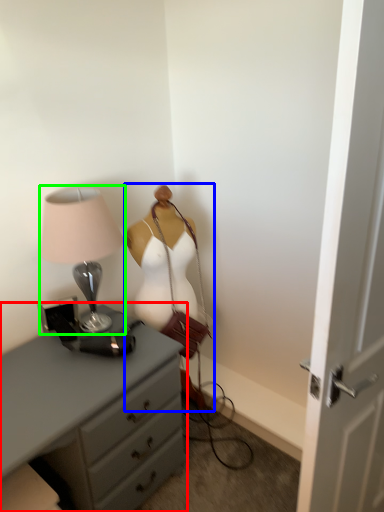
Question: Which is nearer to the chest of drawers (highlighted by a red box)? mannequin (highlighted by a blue box) or lamp (highlighted by a green box).

Choices:
 (A) mannequin
 (B) lamp

Answer: (B)